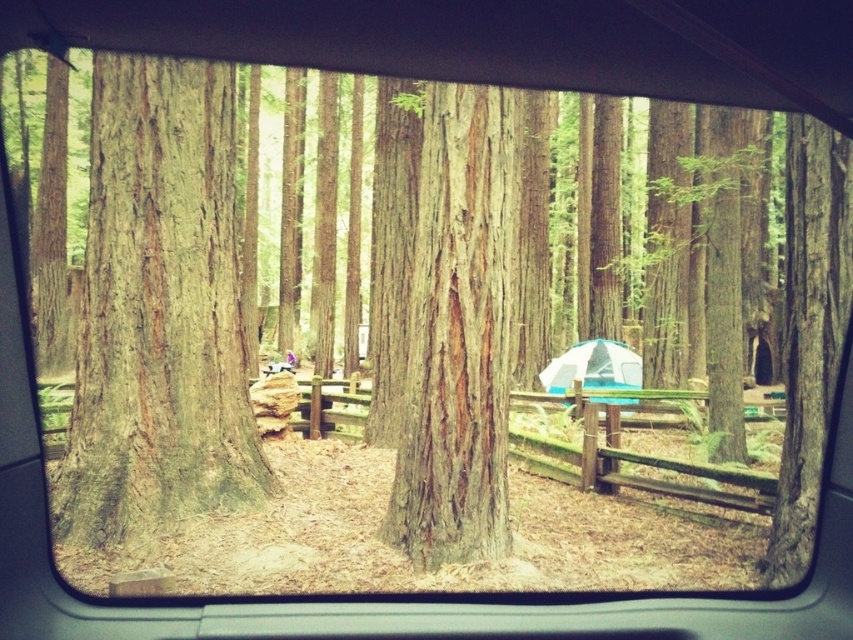
Between point (508, 173) and point (595, 401), which one is positioned behind?

The point (595, 401) is behind.

Is the position of smooth gray bark at center less distant than that of white fabric tent at center?

That is True.

Describe the element at coordinates (457, 336) in the screenshot. I see `smooth gray bark at center` at that location.

At what (x,y) coordinates should I click in order to perform the action: click on smooth gray bark at center. Please return your answer as a coordinate pair (x, y). The width and height of the screenshot is (853, 640). Looking at the image, I should click on (457, 336).

Which is below, smooth brown tree trunk at center or white fabric tent at center?

white fabric tent at center

Is the position of smooth brown tree trunk at center less distant than that of white fabric tent at center?

Yes.

Locate an element on the screen. Image resolution: width=853 pixels, height=640 pixels. smooth brown tree trunk at center is located at coordinates (158, 310).

Who is more distant from viewer, (x=161, y=120) or (x=471, y=157)?

Positioned behind is point (x=161, y=120).

Is smooth brown tree trunk at center thinner than smooth gray bark at center?

In fact, smooth brown tree trunk at center might be wider than smooth gray bark at center.

What do you see at coordinates (158, 310) in the screenshot? This screenshot has height=640, width=853. I see `smooth brown tree trunk at center` at bounding box center [158, 310].

Locate an element on the screen. smooth brown tree trunk at center is located at coordinates (158, 310).